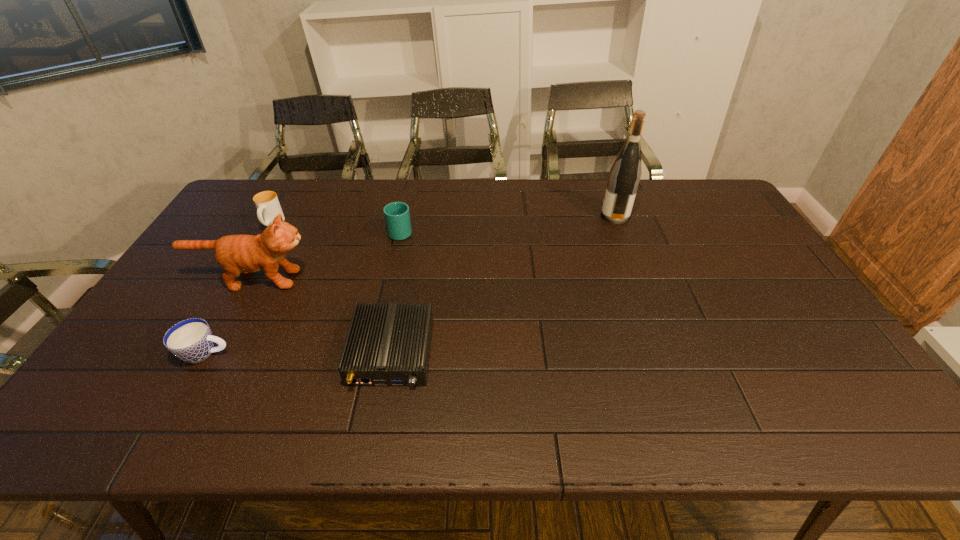
Where is `vacant space at the left edge of the desktop`? vacant space at the left edge of the desktop is located at coordinates (132, 344).

Image resolution: width=960 pixels, height=540 pixels. I want to click on free point at the right edge, so click(789, 286).

Where is `vacant region at the far left corner of the desktop`? The width and height of the screenshot is (960, 540). vacant region at the far left corner of the desktop is located at coordinates (263, 186).

At what (x,y) coordinates should I click in order to perform the action: click on blank space at the near left corner of the desktop. Please return your answer as a coordinate pair (x, y). Looking at the image, I should click on (123, 404).

You are a GUI agent. You are given a task and a screenshot of the screen. Output one action in this format:
    pyautogui.click(x=<x>, y=<y>)
    Task: Click on the free spot between the second tallest object and the nearest cup
    
    Given the screenshot: What is the action you would take?
    pyautogui.click(x=229, y=316)

Find the location of a particular element. free space between the wine bottle and the router is located at coordinates (503, 285).

Where is `vacant region between the second tallest object and the rightmost cup`? The width and height of the screenshot is (960, 540). vacant region between the second tallest object and the rightmost cup is located at coordinates (326, 255).

Where is `free point between the router and the rightmost cup`? free point between the router and the rightmost cup is located at coordinates (396, 292).

Locate an element on the screen. The height and width of the screenshot is (540, 960). blank region between the rightmost cup and the cat is located at coordinates (326, 255).

This screenshot has width=960, height=540. Find the location of `free space that is in between the rightmost cup and the router`. free space that is in between the rightmost cup and the router is located at coordinates (396, 292).